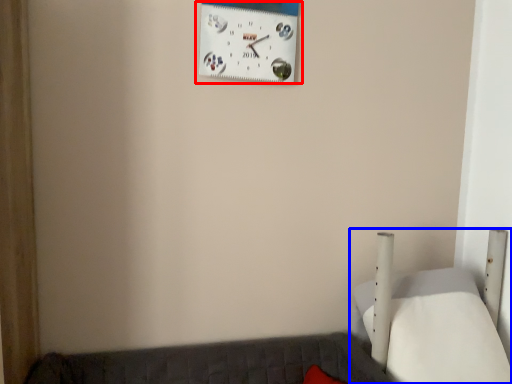
Question: Among these objects, which one is farthest to the camera, wall clock (highlighted by a red box) or furniture (highlighted by a blue box)?

Choices:
 (A) wall clock
 (B) furniture

Answer: (A)